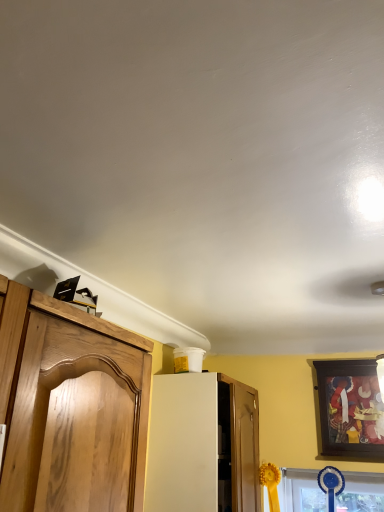
Measure the distance between white matte cabinet at center and camera.

The distance of white matte cabinet at center from camera is 5.05 feet.

This screenshot has width=384, height=512. Find the location of `white matte cabinet at center`. white matte cabinet at center is located at coordinates (202, 443).

Image resolution: width=384 pixels, height=512 pixels. What do you see at coordinates (202, 443) in the screenshot?
I see `white matte cabinet at center` at bounding box center [202, 443].

This screenshot has width=384, height=512. I want to click on wooden picture frame at upper right, so 349,408.

The image size is (384, 512). What do you see at coordinates (349, 408) in the screenshot?
I see `wooden picture frame at upper right` at bounding box center [349, 408].

Where is `white matte cabinet at center`? This screenshot has height=512, width=384. white matte cabinet at center is located at coordinates (202, 443).

Can you confirm if white matte cabinet at center is positioned to the left of wooden picture frame at upper right?

Yes, white matte cabinet at center is to the left of wooden picture frame at upper right.

Relative to wooden picture frame at upper right, is white matte cabinet at center in front or behind?

white matte cabinet at center is positioned closer to the viewer than wooden picture frame at upper right.

Is point (166, 485) positioned before point (327, 408)?

That is True.

From the image's perspective, which one is positioned higher, white matte cabinet at center or wooden picture frame at upper right?

wooden picture frame at upper right.

From a real-world perspective, does white matte cabinet at center stand above wooden picture frame at upper right?

No, from a real-world perspective, white matte cabinet at center is not on top of wooden picture frame at upper right.

Is white matte cabinet at center wider than wooden picture frame at upper right?

Yes.

Based on the photo, who is taller, white matte cabinet at center or wooden picture frame at upper right?

white matte cabinet at center.

Does white matte cabinet at center have a smaller size compared to wooden picture frame at upper right?

No.

From the picture: Is white matte cabinet at center located outside wooden picture frame at upper right?

Yes, white matte cabinet at center is outside of wooden picture frame at upper right.

Is white matte cabinet at center next to wooden picture frame at upper right?

white matte cabinet at center and wooden picture frame at upper right are clearly separated.

Could you tell me if white matte cabinet at center is facing wooden picture frame at upper right?

Yes, white matte cabinet at center is aimed at wooden picture frame at upper right.

This screenshot has width=384, height=512. I want to click on picture frame above the white matte cabinet at center (from the image's perspective), so 349,408.

Is wooden picture frame at upper right to the right of white matte cabinet at center from the viewer's perspective?

Indeed, wooden picture frame at upper right is positioned on the right side of white matte cabinet at center.

Considering the relative positions of wooden picture frame at upper right and white matte cabinet at center in the image provided, is wooden picture frame at upper right in front of white matte cabinet at center?

That is False.

Is point (355, 372) positioned behind point (154, 465)?

That is True.

From the image's perspective, which one is positioned lower, wooden picture frame at upper right or white matte cabinet at center?

white matte cabinet at center.

From a real-world perspective, does wooden picture frame at upper right sit lower than white matte cabinet at center?

No.

Which of these two, wooden picture frame at upper right or white matte cabinet at center, is thinner?

Thinner between the two is wooden picture frame at upper right.

Is wooden picture frame at upper right shorter than white matte cabinet at center?

Correct, wooden picture frame at upper right is not as tall as white matte cabinet at center.

In terms of size, does wooden picture frame at upper right appear bigger or smaller than white matte cabinet at center?

Clearly, wooden picture frame at upper right is smaller in size than white matte cabinet at center.

Looking at this image, is white matte cabinet at center surrounded by wooden picture frame at upper right?

No.

Is wooden picture frame at upper right not near white matte cabinet at center?

wooden picture frame at upper right is near white matte cabinet at center, not far away.

From the picture: Is wooden picture frame at upper right facing towards white matte cabinet at center?

No.

How different are the orientations of wooden picture frame at upper right and white matte cabinet at center in degrees?

90.5 degrees separate the facing orientations of wooden picture frame at upper right and white matte cabinet at center.

How far apart are wooden picture frame at upper right and white matte cabinet at center?

A distance of 24.25 inches exists between wooden picture frame at upper right and white matte cabinet at center.

I want to click on cabinetry located on the left of wooden picture frame at upper right, so click(x=202, y=443).

The height and width of the screenshot is (512, 384). Identify the location of picture frame that appears on the right of white matte cabinet at center. (349, 408).

What are the coordinates of `cabinetry on the left of wooden picture frame at upper right` in the screenshot? It's located at tap(202, 443).